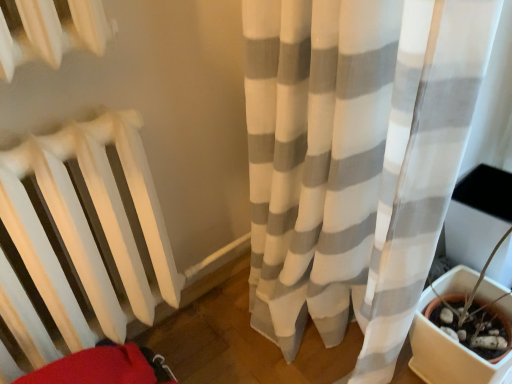
What are the coordinates of `white sheer curtain at right` in the screenshot? It's located at (320, 161).

Describe the element at coordinates (320, 161) in the screenshot. I see `white sheer curtain at right` at that location.

Measure the distance between point (406, 22) and camera.

The distance of point (406, 22) from camera is 25.67 inches.

You are a GUI agent. You are given a task and a screenshot of the screen. Output one action in this format:
    pyautogui.click(x=<x>, y=<y>)
    Task: Click on the white sheer curtain at right
    Image resolution: width=512 pixels, height=384 pixels.
    Given the screenshot: What is the action you would take?
    tap(320, 161)